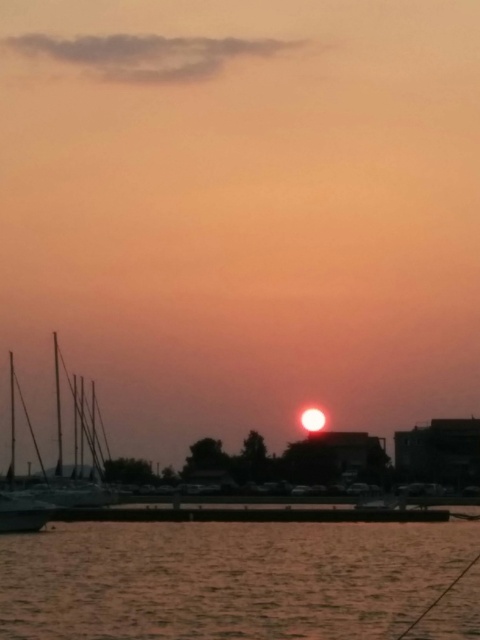
Looking at this image, you are standing on the dock and see the silvery metallic masts at left and the silvery metallic sailboat at left. Which object is closer to the water surface?

The silvery metallic masts at left are closer to the water surface than the silvery metallic sailboat at left because the masts are positioned below the sailboat in the image.

You are standing at the center of the image and want to walk towards the point at coordinates (79, 449). Which direction should you go?

The point at (79, 449) is on the silvery metallic masts at left, so you should walk towards the left side of the image to reach it.

You are standing at the center of the image and want to walk towards the smooth water at lower center. According to the coordinates provided, in which direction should you move?

The smooth water at lower center is located at coordinates point (226, 579). Since the Y coordinate is 0.471, which is below the center point of 0.5, you should move downward to reach it.